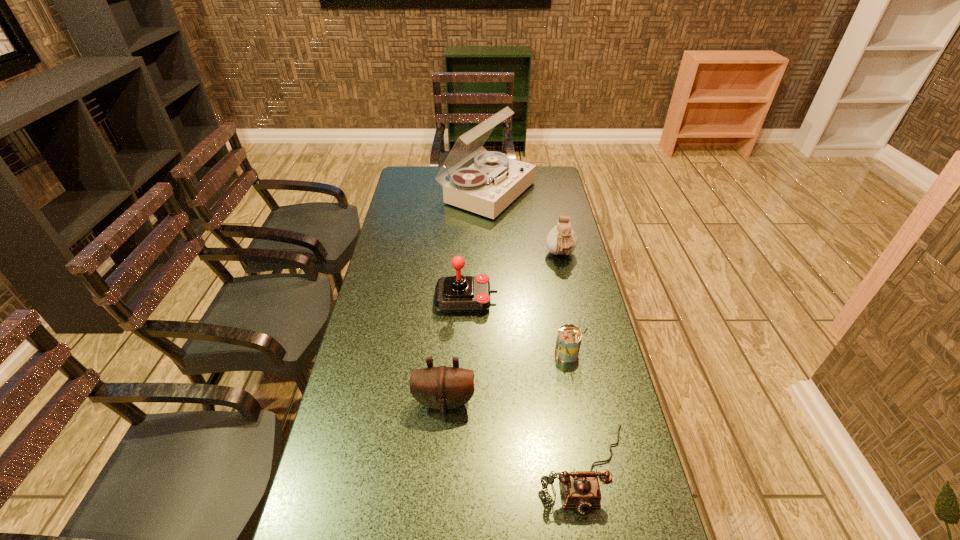
Locate an element on the screen. This screenshot has height=540, width=960. vacant space located on the right of the tallest object is located at coordinates (552, 192).

At what (x,y) coordinates should I click in order to perform the action: click on vacant position located 0.260m on the base of the joystick. Please return your answer as a coordinate pair (x, y). The width and height of the screenshot is (960, 540). Looking at the image, I should click on (574, 299).

I want to click on vacant space located on the front-facing side of the fifth nearest object, so click(x=579, y=340).

The height and width of the screenshot is (540, 960). What are the coordinates of `vacant space situated 0.240m with the flap open on the nearer pouch` in the screenshot? It's located at 437,512.

Where is `vacant space situated 0.330m on the front of the can`? This screenshot has width=960, height=540. vacant space situated 0.330m on the front of the can is located at coordinates (593, 482).

You are a GUI agent. You are given a task and a screenshot of the screen. Output one action in this format:
    pyautogui.click(x=<x>, y=<y>)
    Task: Click on the object at the far edge
    The height and width of the screenshot is (540, 960).
    Given the screenshot: What is the action you would take?
    pyautogui.click(x=488, y=186)

The height and width of the screenshot is (540, 960). In order to click on record player that is positioned at the right edge in this screenshot , I will do `click(488, 186)`.

This screenshot has height=540, width=960. In order to click on pouch situated at the right edge in this screenshot , I will do `click(561, 240)`.

What are the coordinates of `can located in the right edge section of the desktop` in the screenshot? It's located at (569, 337).

Where is `telephone at the right edge`? This screenshot has height=540, width=960. telephone at the right edge is located at coordinates (x=580, y=489).